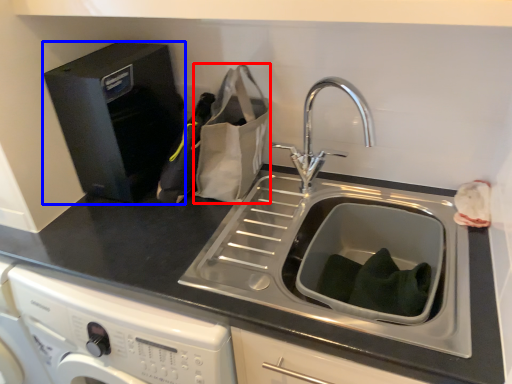
Question: Which object appears closest to the camera in this image, paper bag (highlighted by a red box) or appliance (highlighted by a blue box)?

Choices:
 (A) paper bag
 (B) appliance

Answer: (A)